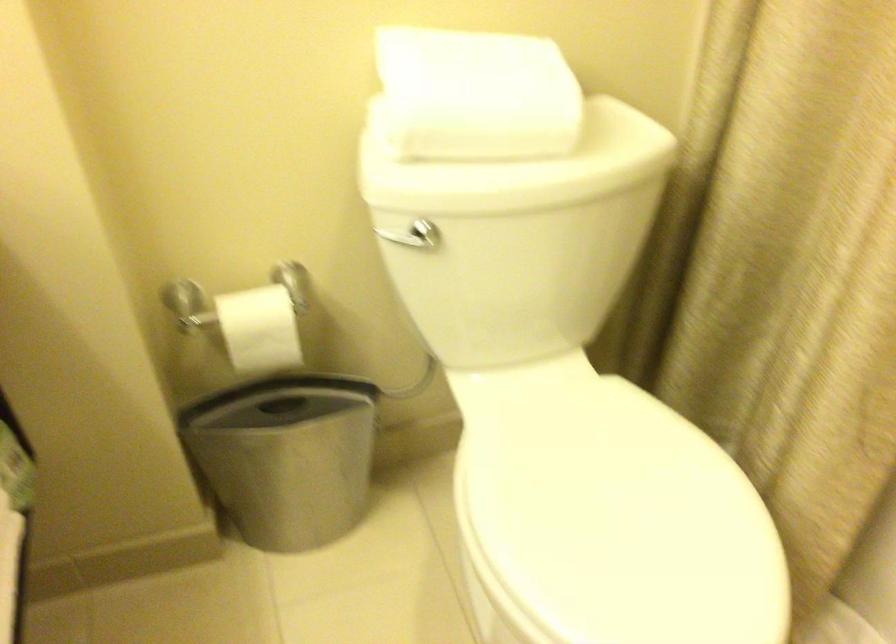
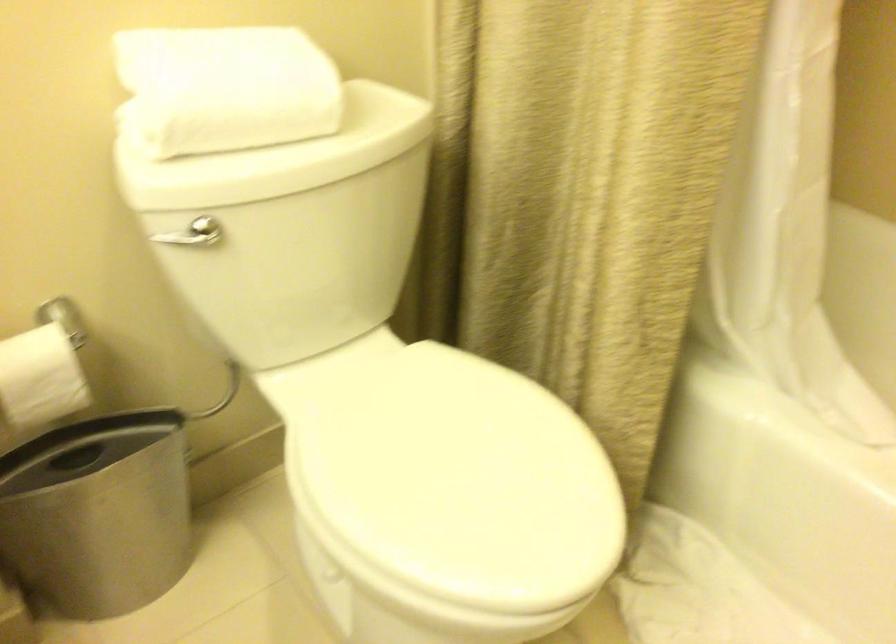
Find the pixel in the second image that matches point 409,234 in the first image.

(192, 232)